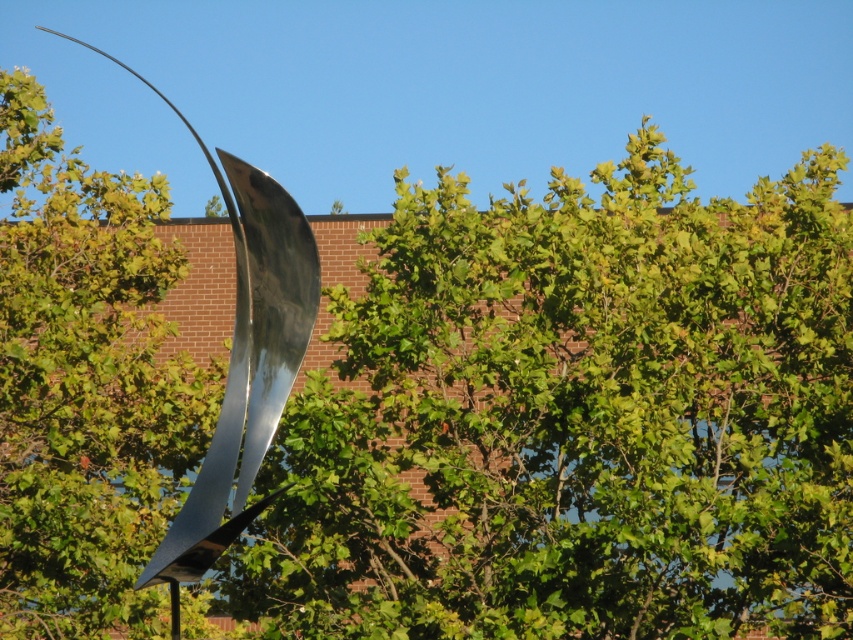
From the picture: Does green leafy tree at center have a larger size compared to shiny metallic sculpture at left?

Incorrect, green leafy tree at center is not larger than shiny metallic sculpture at left.

Is point (450, 614) farther from camera compared to point (276, 355)?

Yes, point (450, 614) is farther from viewer.

Is point (567, 184) positioned behind point (212, 490)?

Yes, point (567, 184) is behind point (212, 490).

Image resolution: width=853 pixels, height=640 pixels. I want to click on green leafy tree at center, so click(x=576, y=419).